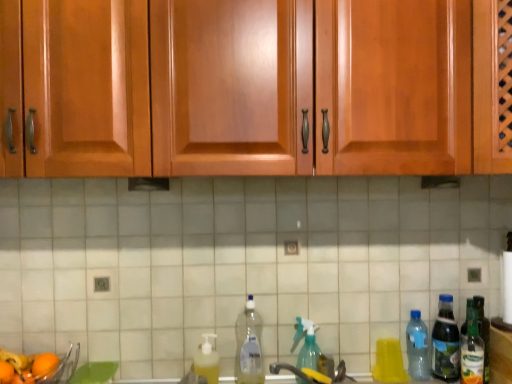
Image resolution: width=512 pixels, height=384 pixels. I want to click on glossy wood cabinets at upper center, so coord(255,87).

Describe the element at coordinates (472, 351) in the screenshot. I see `green glass bottle at right, which is the 7th bottle in left-to-right order` at that location.

Identify the location of translucent plastic soap dispenser at lower center, the first bottle viewed from the left. (207, 359).

Locate an element on the screen. yellow plastic cup at lower right, marked as the fourth bottle in a left-to-right arrangement is located at coordinates (389, 362).

The image size is (512, 384). I want to click on translucent plastic bottle at right, acting as the 6th bottle starting from the left, so point(445,342).

In order to click on glossy wood cabinets at upper center in this screenshot , I will do `click(255, 87)`.

From the picture: Is orange matte at lower left, the first orange when ordered from right to left, to the left of translucent plastic bottle at right, which appears as the 2th bottle when viewed from the right, from the viewer's perspective?

Indeed, orange matte at lower left, the first orange when ordered from right to left, is positioned on the left side of translucent plastic bottle at right, which appears as the 2th bottle when viewed from the right.

From the image's perspective, is orange matte at lower left, the first orange when ordered from right to left, located above translucent plastic bottle at right, acting as the 6th bottle starting from the left?

Incorrect, from the image's perspective, orange matte at lower left, the first orange when ordered from right to left, is lower than translucent plastic bottle at right, acting as the 6th bottle starting from the left.

Is orange matte at lower left, marked as the first orange in a back-to-front arrangement, completely or partially outside of translucent plastic bottle at right, acting as the 6th bottle starting from the left?

Indeed, orange matte at lower left, marked as the first orange in a back-to-front arrangement, is completely outside translucent plastic bottle at right, acting as the 6th bottle starting from the left.

Is orange matte at lower left, marked as the first orange in a back-to-front arrangement, not close to green glass bottle at right, which is the 7th bottle in left-to-right order?

Yes, orange matte at lower left, marked as the first orange in a back-to-front arrangement, is far from green glass bottle at right, which is the 7th bottle in left-to-right order.

Considering the relative positions of orange matte at lower left, placed as the second orange when sorted from front to back, and green glass bottle at right, which ranks as the 1th bottle in right-to-left order, in the image provided, is orange matte at lower left, placed as the second orange when sorted from front to back, to the left or to the right of green glass bottle at right, which ranks as the 1th bottle in right-to-left order,?

Clearly, orange matte at lower left, placed as the second orange when sorted from front to back, is on the left of green glass bottle at right, which ranks as the 1th bottle in right-to-left order, in the image.

From a real-world perspective, is orange matte at lower left, the first orange when ordered from right to left, physically located above or below green glass bottle at right, which ranks as the 1th bottle in right-to-left order?

Clearly, from a real-world perspective, orange matte at lower left, the first orange when ordered from right to left, is below green glass bottle at right, which ranks as the 1th bottle in right-to-left order.

Can you confirm if yellow plastic cup at lower right, marked as the fourth bottle in a left-to-right arrangement, is smaller than clear plastic bottle at center, the sixth bottle from the right?

Yes, yellow plastic cup at lower right, marked as the fourth bottle in a left-to-right arrangement, is smaller than clear plastic bottle at center, the sixth bottle from the right.

Which object is wider, yellow plastic cup at lower right, which is the 4th bottle in right-to-left order, or clear plastic bottle at center, the 2th bottle when ordered from left to right?

clear plastic bottle at center, the 2th bottle when ordered from left to right.

Does yellow plastic cup at lower right, marked as the fourth bottle in a left-to-right arrangement, have a greater height compared to clear plastic bottle at center, the sixth bottle from the right?

No.

Is black matte exhaust hood at center smaller than translucent plastic bottle at right, acting as the 6th bottle starting from the left?

Yes.

From a real-world perspective, does black matte exhaust hood at center sit lower than translucent plastic bottle at right, which appears as the 2th bottle when viewed from the right?

Actually, black matte exhaust hood at center is physically above translucent plastic bottle at right, which appears as the 2th bottle when viewed from the right, in the real world.

How different are the orientations of black matte exhaust hood at center and translucent plastic bottle at right, which appears as the 2th bottle when viewed from the right, in degrees?

black matte exhaust hood at center and translucent plastic bottle at right, which appears as the 2th bottle when viewed from the right, are facing 0.0897 degrees away from each other.

Is black matte exhaust hood at center aimed at translucent plastic bottle at right, which appears as the 2th bottle when viewed from the right?

No, black matte exhaust hood at center is not aimed at translucent plastic bottle at right, which appears as the 2th bottle when viewed from the right.

Does glossy wood cabinets at upper center have a smaller size compared to green glass bottle at right, which ranks as the 1th bottle in right-to-left order?

Incorrect, glossy wood cabinets at upper center is not smaller in size than green glass bottle at right, which ranks as the 1th bottle in right-to-left order.

From the image's perspective, would you say glossy wood cabinets at upper center is shown under green glass bottle at right, which is the 7th bottle in left-to-right order?

Incorrect, from the image's perspective, glossy wood cabinets at upper center is higher than green glass bottle at right, which is the 7th bottle in left-to-right order.

Is glossy wood cabinets at upper center wider or thinner than green glass bottle at right, which is the 7th bottle in left-to-right order?

In the image, glossy wood cabinets at upper center appears to be wider than green glass bottle at right, which is the 7th bottle in left-to-right order.

From the picture: Could you tell me if glossy wood cabinets at upper center is facing green glass bottle at right, which is the 7th bottle in left-to-right order?

No, glossy wood cabinets at upper center does not turn towards green glass bottle at right, which is the 7th bottle in left-to-right order.

Is glossy wood cabinets at upper center at the back of clear plastic bottle at right, which is counted as the fifth bottle, starting from the left?

No, clear plastic bottle at right, which is counted as the fifth bottle, starting from the left, is not facing away from glossy wood cabinets at upper center.

Which of these two, clear plastic bottle at right, which is counted as the fifth bottle, starting from the left, or glossy wood cabinets at upper center, is bigger?

Bigger between the two is glossy wood cabinets at upper center.

Is glossy wood cabinets at upper center located within clear plastic bottle at right, arranged as the 3th bottle when viewed from the right?

That's incorrect, glossy wood cabinets at upper center is not inside clear plastic bottle at right, arranged as the 3th bottle when viewed from the right.

Is there a large distance between clear plastic bottle at right, which is counted as the fifth bottle, starting from the left, and orange matte at lower left, which is counted as the first orange, starting from the left?

Yes, clear plastic bottle at right, which is counted as the fifth bottle, starting from the left, and orange matte at lower left, which is counted as the first orange, starting from the left, are located far from each other.

From the orange matte at lower left, which is the first orange in front-to-back order, count 5th bottle to the right and point to it. Please provide its 2D coordinates.

[(417, 347)]

How far apart are clear plastic bottle at right, which is counted as the fifth bottle, starting from the left, and orange matte at lower left, arranged as the 2th orange when viewed from the right?

clear plastic bottle at right, which is counted as the fifth bottle, starting from the left, and orange matte at lower left, arranged as the 2th orange when viewed from the right, are 4.20 feet apart.

Is clear plastic bottle at right, arranged as the 3th bottle when viewed from the right, to the right of orange matte at lower left, which is counted as the 2th orange, starting from the back, from the viewer's perspective?

Yes.

Locate an element on the screen. The height and width of the screenshot is (384, 512). orange that is the 1st object located below the translucent plastic bottle at right, acting as the 6th bottle starting from the left (from the image's perspective) is located at coordinates (45, 365).

From a real-world perspective, which bottle is the 1st one above the orange matte at lower left, the first orange when ordered from right to left? Please provide its 2D coordinates.

[(472, 351)]

Which object lies further to the anchor point translucent plastic soap dispenser at lower center, which is counted as the seventh bottle, starting from the right, orange matte at lower left, which is counted as the first orange, starting from the left, or white tile at center?

The object further to translucent plastic soap dispenser at lower center, which is counted as the seventh bottle, starting from the right, is orange matte at lower left, which is counted as the first orange, starting from the left.

Considering their positions, is black matte exhaust hood at center positioned further to translucent plastic soap dispenser at lower center, which is counted as the seventh bottle, starting from the right, than white tile at center?

black matte exhaust hood at center lies further to translucent plastic soap dispenser at lower center, which is counted as the seventh bottle, starting from the right, than the other object.

From the image, which object appears to be nearer to clear plastic bottle at center, the sixth bottle from the right, orange matte at lower left, which is the first orange in front-to-back order, or glossy wood cabinets at upper center?

orange matte at lower left, which is the first orange in front-to-back order, is positioned closer to the anchor clear plastic bottle at center, the sixth bottle from the right.

When comparing their distances from green glass bottle at right, which ranks as the 1th bottle in right-to-left order, does clear plastic bottle at center, the sixth bottle from the right, or black matte exhaust hood at center seem further?

Among the two, black matte exhaust hood at center is located further to green glass bottle at right, which ranks as the 1th bottle in right-to-left order.

Estimate the real-world distances between objects in this image. Which object is closer to translucent plastic soap dispenser at lower center, which is counted as the seventh bottle, starting from the right, green glass bottle at right, which ranks as the 1th bottle in right-to-left order, or orange matte at lower left, marked as the first orange in a back-to-front arrangement?

The object closer to translucent plastic soap dispenser at lower center, which is counted as the seventh bottle, starting from the right, is orange matte at lower left, marked as the first orange in a back-to-front arrangement.

Which object lies further to the anchor point clear plastic bottle at center, the sixth bottle from the right, translucent plastic spray bottle at center, the fifth bottle in the right-to-left sequence, or clear plastic bottle at right, arranged as the 3th bottle when viewed from the right?

The object further to clear plastic bottle at center, the sixth bottle from the right, is clear plastic bottle at right, arranged as the 3th bottle when viewed from the right.

From the image, which object appears to be farther from translucent plastic spray bottle at center, the fifth bottle in the right-to-left sequence, translucent plastic soap dispenser at lower center, which is counted as the seventh bottle, starting from the right, or clear plastic bottle at right, which is counted as the fifth bottle, starting from the left?

clear plastic bottle at right, which is counted as the fifth bottle, starting from the left, lies further to translucent plastic spray bottle at center, the fifth bottle in the right-to-left sequence, than the other object.

Looking at the image, which one is located further to translucent plastic soap dispenser at lower center, which is counted as the seventh bottle, starting from the right, translucent plastic bottle at right, which appears as the 2th bottle when viewed from the right, or orange matte at lower left, marked as the first orange in a back-to-front arrangement?

translucent plastic bottle at right, which appears as the 2th bottle when viewed from the right, is positioned further to the anchor translucent plastic soap dispenser at lower center, which is counted as the seventh bottle, starting from the right.

Where is `tile located between orange matte at lower left, placed as the second orange when sorted from front to back, and translucent plastic spray bottle at center, placed as the 3th bottle when sorted from left to right, in the left-right direction`? This screenshot has width=512, height=384. tile located between orange matte at lower left, placed as the second orange when sorted from front to back, and translucent plastic spray bottle at center, placed as the 3th bottle when sorted from left to right, in the left-right direction is located at coordinates (239, 263).

Find the location of `cabinetry between orange matte at lower left, marked as the first orange in a back-to-front arrangement, and yellow plastic cup at lower right, marked as the fourth bottle in a left-to-right arrangement`. cabinetry between orange matte at lower left, marked as the first orange in a back-to-front arrangement, and yellow plastic cup at lower right, marked as the fourth bottle in a left-to-right arrangement is located at coordinates (255, 87).

In order to click on cabinetry between orange matte at lower left, the 2th orange in the left-to-right sequence, and translucent plastic bottle at right, which appears as the 2th bottle when viewed from the right, from left to right in this screenshot , I will do [255, 87].

In order to click on tile situated between clear plastic bottle at center, the 2th bottle when ordered from left to right, and green glass bottle at right, which is the 7th bottle in left-to-right order, from left to right in this screenshot , I will do `click(239, 263)`.